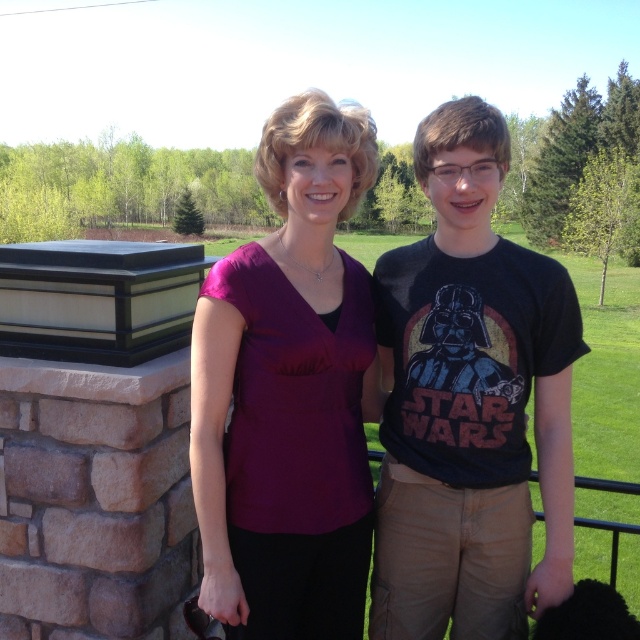
Can you confirm if dark gray t-shirt at center is positioned to the left of matte purple blouse at center?

No, dark gray t-shirt at center is not to the left of matte purple blouse at center.

Between dark gray t-shirt at center and matte purple blouse at center, which one has more height?

dark gray t-shirt at center

Where is `dark gray t-shirt at center`? This screenshot has height=640, width=640. dark gray t-shirt at center is located at coordinates (468, 403).